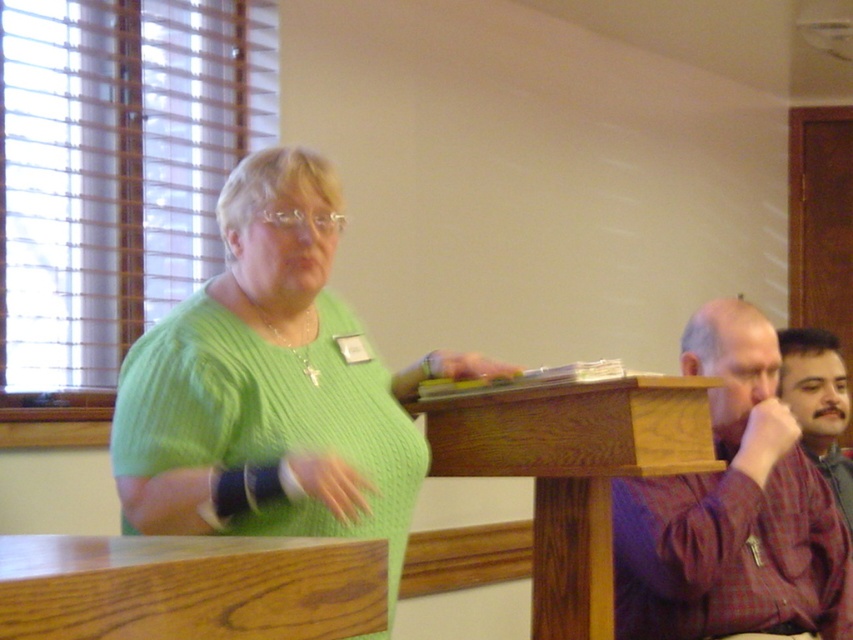
You are attending a presentation and need to exit the room through the door on the right. The wooden podium at center and brown plaid shirt at right are in your way. Which object should you move around first to reach the door?

You should move around the wooden podium at center first because it is positioned to the left of the brown plaid shirt at right, so it is closer to your path towards the door on the right side of the room.